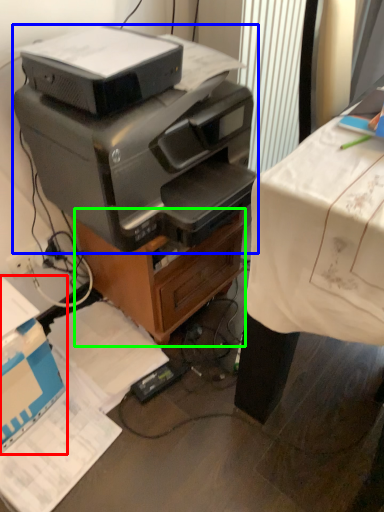
Question: Based on their relative distances, which object is farther from cardboard box (highlighted by a red box)? Choose from printer (highlighted by a blue box) and file cabinet (highlighted by a green box).

Choices:
 (A) printer
 (B) file cabinet

Answer: (A)